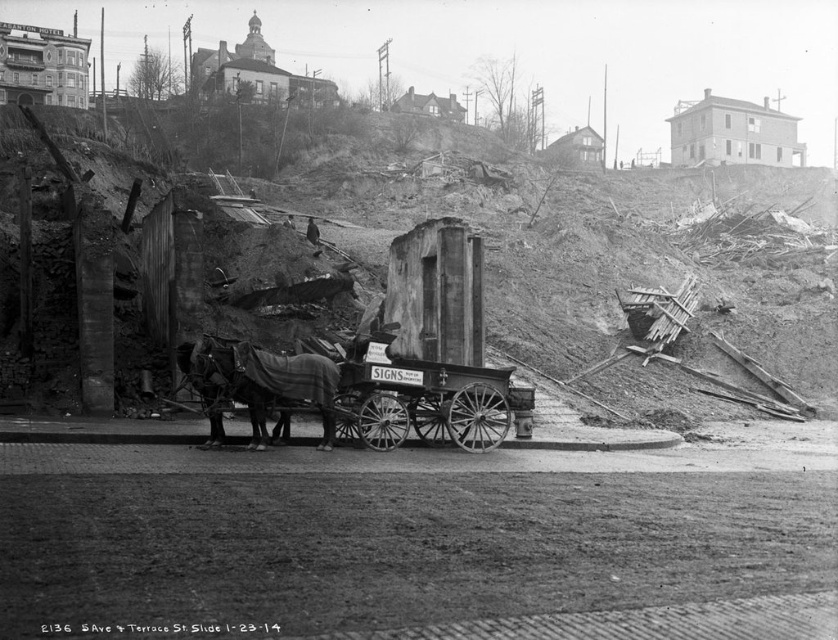
Question: Observing the image, what is the correct spatial positioning of wooden cart at center in reference to dark brown blanket-covered horse at center?

Choices:
 (A) right
 (B) left

Answer: (A)

Question: Among these points, which one is nearest to the camera?

Choices:
 (A) (184, 365)
 (B) (495, 435)

Answer: (A)

Question: Which object appears closest to the camera in this image?

Choices:
 (A) wooden cart at center
 (B) dark brown blanket-covered horse at center

Answer: (B)

Question: Is wooden cart at center closer to the viewer compared to dark brown blanket-covered horse at center?

Choices:
 (A) no
 (B) yes

Answer: (A)

Question: Can you confirm if wooden cart at center is positioned to the left of dark brown blanket-covered horse at center?

Choices:
 (A) no
 (B) yes

Answer: (A)